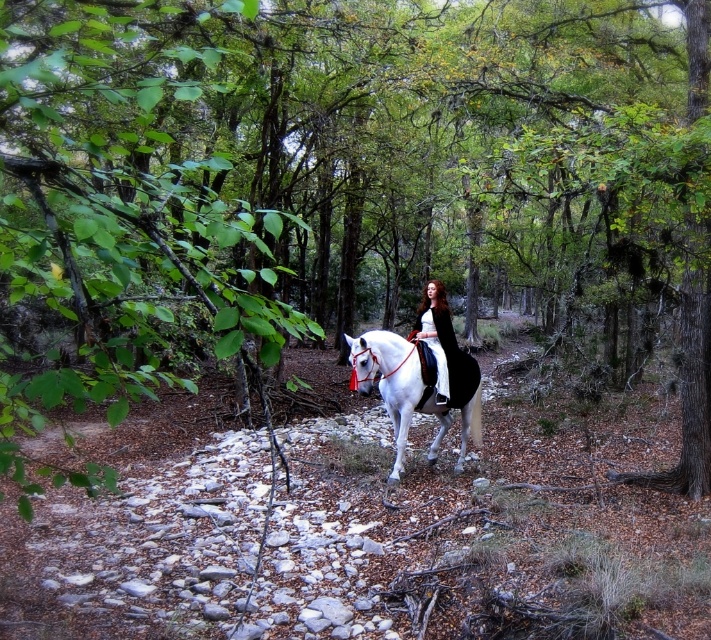
You are a traveler in the forest and see the white glossy horse at center and the velvet black coat at center. Which object is positioned to the left?

The white glossy horse at center is positioned to the left of the velvet black coat at center.

You are a forest guide leading a group through the dense forest. You notice a rider on a horse and a person wearing a coat ahead. Based on the scene, which object is closer to you, the white glossy horse at center or the velvet black coat at center?

The white glossy horse at center is closer to you because it is positioned in front of the velvet black coat at center.